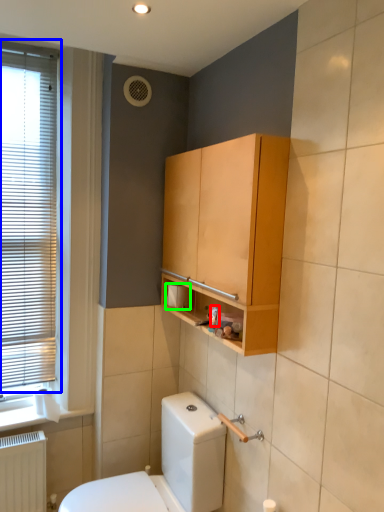
Question: Based on their relative distances, which object is nearer to toiletry (highlighted by a red box)? Choose from window (highlighted by a blue box) and toilet paper (highlighted by a green box).

Choices:
 (A) window
 (B) toilet paper

Answer: (B)